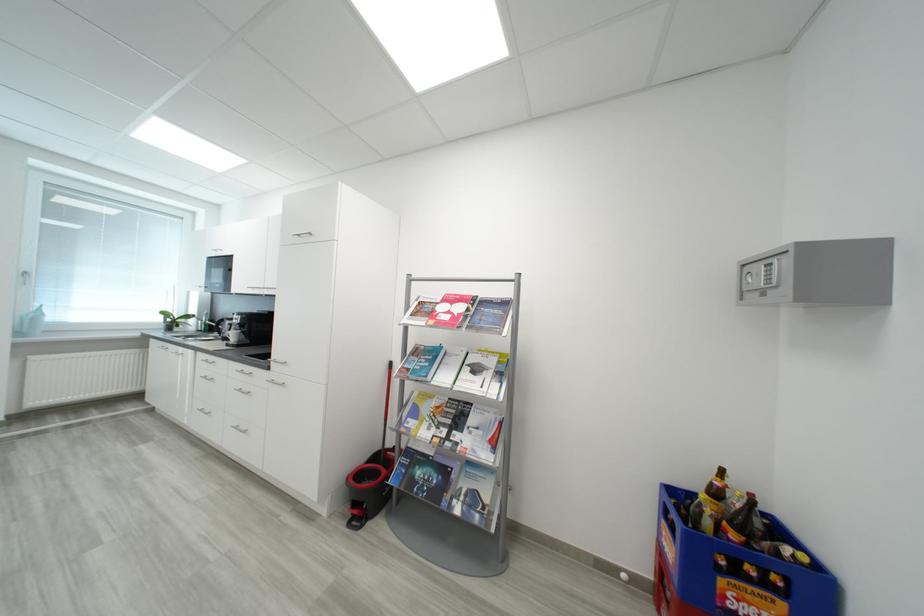
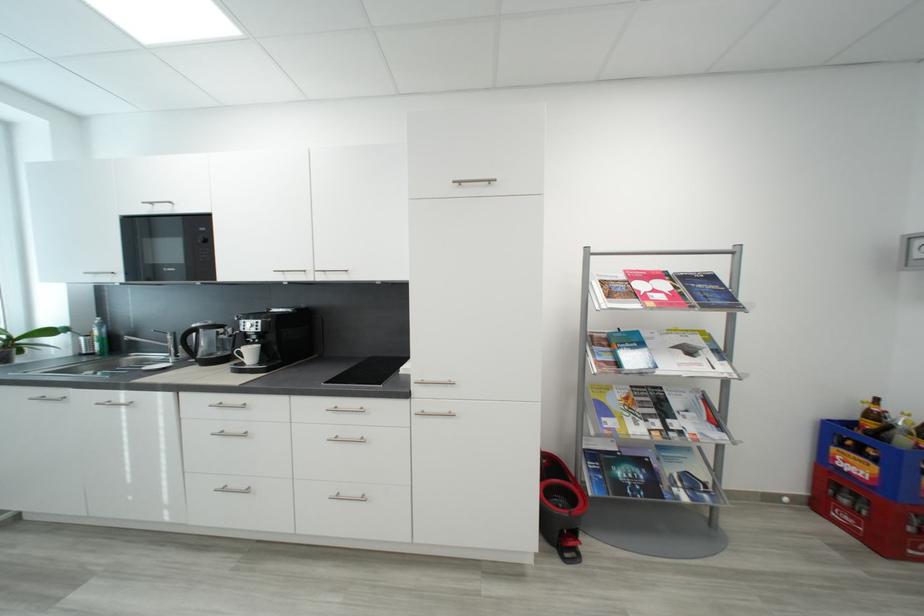
Find the pixel in the second image that matches point (480, 422) in the first image.

(684, 406)